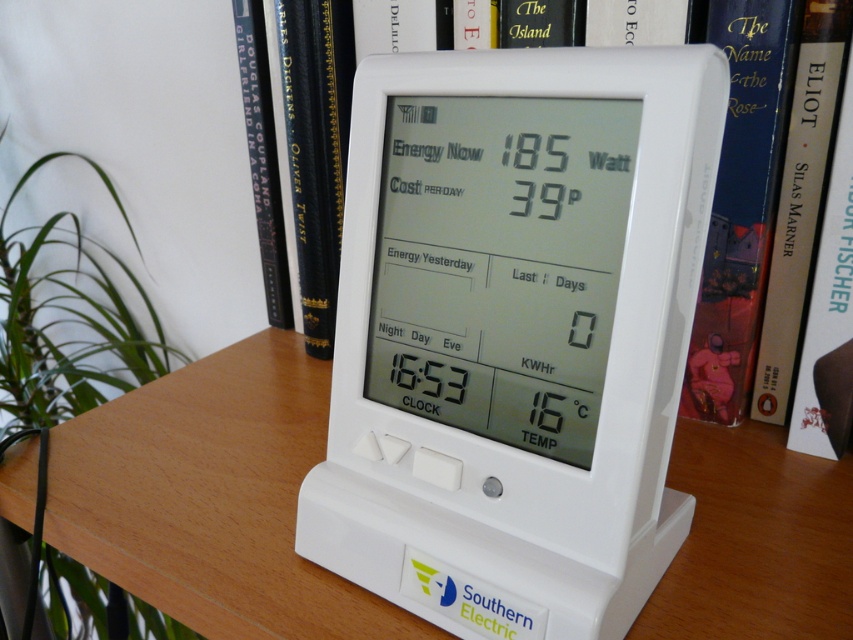
Question: Which object is positioned closest to the white plastic thermometer at center?

Choices:
 (A) hardcover book at upper center
 (B) white plastic table at center

Answer: (B)

Question: Can you confirm if white plastic table at center is positioned to the right of hardcover book at upper center?

Choices:
 (A) yes
 (B) no

Answer: (B)

Question: Which object appears closest to the camera in this image?

Choices:
 (A) white plastic thermometer at center
 (B) hardcover book at center
 (C) white plastic table at center

Answer: (A)

Question: Among these objects, which one is farthest from the camera?

Choices:
 (A) white plastic thermometer at center
 (B) hardcover book at upper right
 (C) hardcover book at center
 (D) hardcover book at upper center

Answer: (C)

Question: Observing the image, what is the correct spatial positioning of white plastic thermometer at center in reference to hardcover book at upper center?

Choices:
 (A) above
 (B) below

Answer: (B)

Question: Can you confirm if white plastic table at center is positioned above hardcover book at upper center?

Choices:
 (A) no
 (B) yes

Answer: (A)